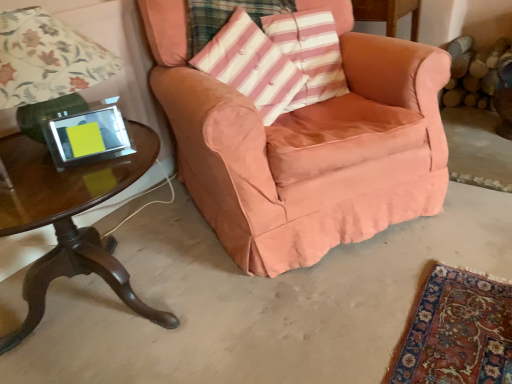
This screenshot has height=384, width=512. In order to click on free space below shiny dark wood table at lower left (from a real-world perspective) in this screenshot , I will do `click(105, 304)`.